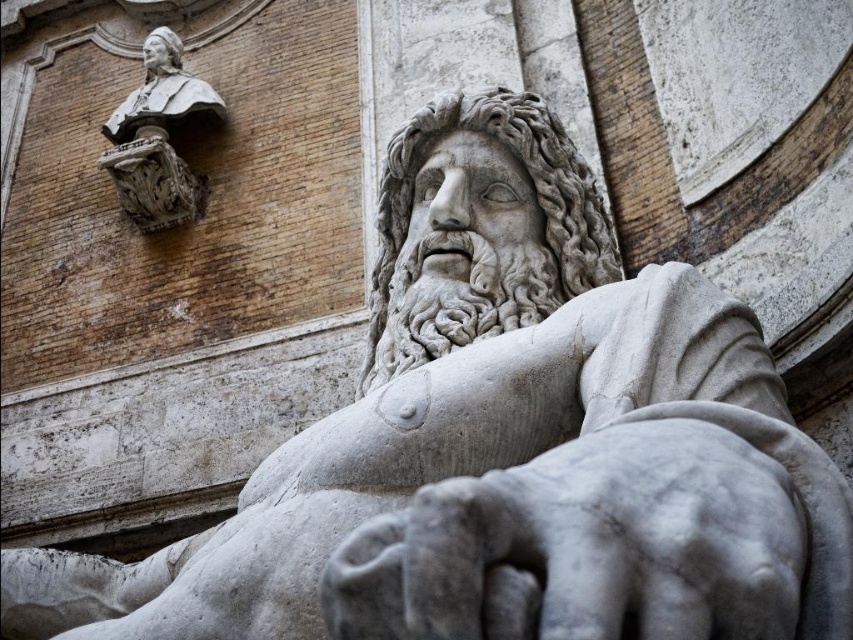
Question: Which point appears closest to the camera in this image?

Choices:
 (A) (144, 104)
 (B) (509, 541)

Answer: (B)

Question: Is gray stone hand at lower center positioned in front of matte stone bust at upper left?

Choices:
 (A) no
 (B) yes

Answer: (B)

Question: Is gray stone hand at lower center to the right of matte stone bust at upper left from the viewer's perspective?

Choices:
 (A) yes
 (B) no

Answer: (A)

Question: Which of the following is the farthest from the observer?

Choices:
 (A) (143, 100)
 (B) (698, 544)

Answer: (A)

Question: Which object appears closest to the camera in this image?

Choices:
 (A) gray stone hand at lower center
 (B) matte stone bust at upper left

Answer: (A)

Question: Is gray stone hand at lower center smaller than matte stone bust at upper left?

Choices:
 (A) yes
 (B) no

Answer: (A)